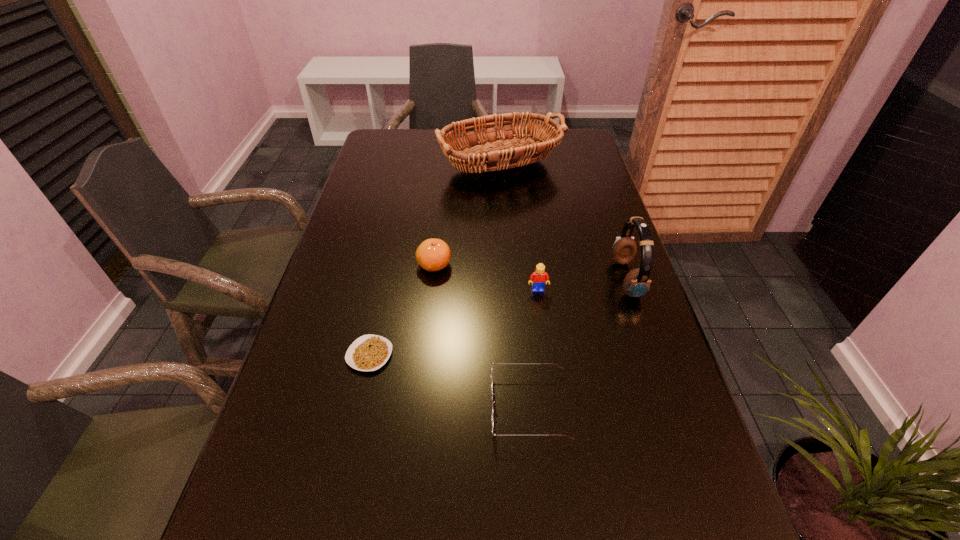
The height and width of the screenshot is (540, 960). What are the coordinates of `the farthest object` in the screenshot? It's located at (495, 152).

In order to click on headset in this screenshot , I will do point(636,283).

The image size is (960, 540). I want to click on Lego, so click(x=538, y=280).

Identify the location of clementine. click(433, 254).

Locate an element on the screen. sunglasses is located at coordinates (492, 393).

The image size is (960, 540). Identify the location of the shortest object. (369, 352).

I want to click on vacant point located on the left of the basket, so click(380, 166).

You are a GUI agent. You are given a task and a screenshot of the screen. Output one action in this format:
    pyautogui.click(x=<x>, y=<y>)
    Task: Click on the vacant point located 0.150m on the ear cup of the headset
    
    Given the screenshot: What is the action you would take?
    click(555, 279)

In order to click on free location located on the ear cup of the headset in this screenshot , I will do coord(511,279).

Identify the location of vacant space situated 0.050m on the ear cup of the headset. (595, 279).